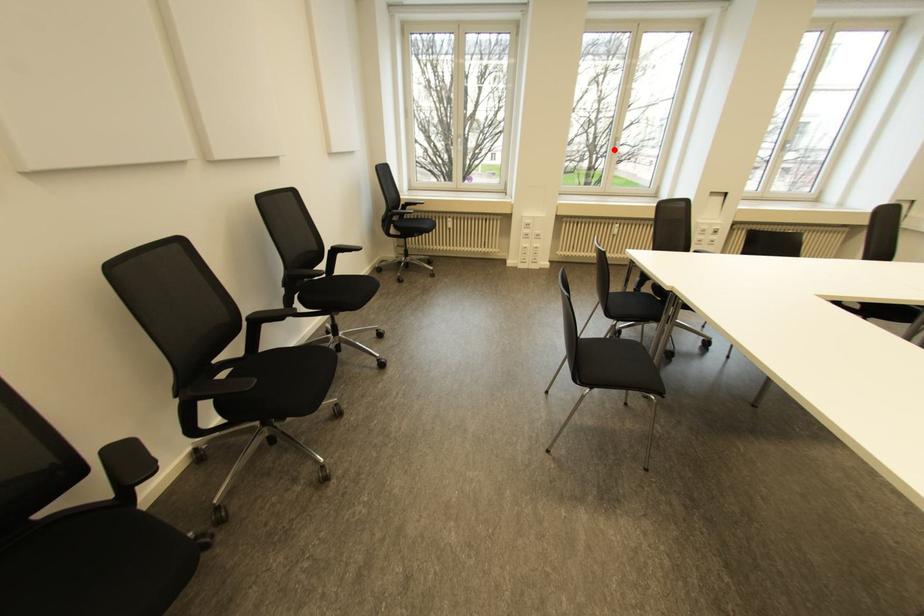
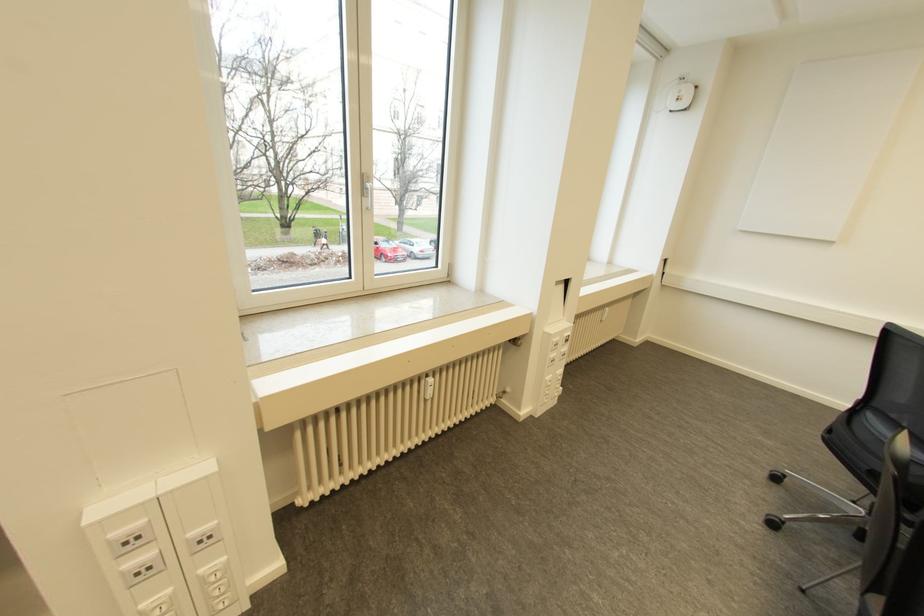
In the second image, find the point that corresponds to the highlighted location in the first image.

(366, 201)